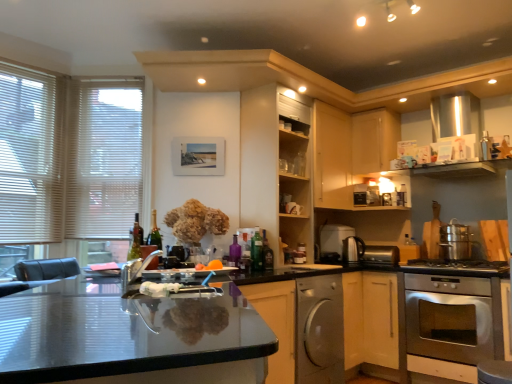
Question: Does green glass wine bottle at left lie behind shiny metallic kettle at right, which is the second appliance in front-to-back order?

Choices:
 (A) yes
 (B) no

Answer: (B)

Question: Is green glass wine bottle at left oriented towards shiny metallic kettle at right, positioned as the third appliance in left-to-right order?

Choices:
 (A) no
 (B) yes

Answer: (A)

Question: Is shiny metallic kettle at right, which is the second appliance in front-to-back order, located within green glass wine bottle at left?

Choices:
 (A) yes
 (B) no

Answer: (B)

Question: Is there a large distance between green glass wine bottle at left and shiny metallic kettle at right, positioned as the third appliance in back-to-front order?

Choices:
 (A) no
 (B) yes

Answer: (B)

Question: Does green glass wine bottle at left have a greater height compared to shiny metallic kettle at right, which is the second appliance in front-to-back order?

Choices:
 (A) yes
 (B) no

Answer: (A)

Question: Does green glass wine bottle at left have a lesser height compared to shiny metallic kettle at right, which is the second appliance in front-to-back order?

Choices:
 (A) no
 (B) yes

Answer: (A)

Question: Can you confirm if satin silver dishwasher at lower center is wider than glossy glass countertop at center?

Choices:
 (A) yes
 (B) no

Answer: (B)

Question: Is satin silver dishwasher at lower center positioned before glossy glass countertop at center?

Choices:
 (A) yes
 (B) no

Answer: (B)

Question: Is satin silver dishwasher at lower center at the left side of glossy glass countertop at center?

Choices:
 (A) no
 (B) yes

Answer: (A)

Question: Is satin silver dishwasher at lower center facing away from glossy glass countertop at center?

Choices:
 (A) yes
 (B) no

Answer: (B)

Question: Is satin silver dishwasher at lower center further to the viewer compared to glossy glass countertop at center?

Choices:
 (A) no
 (B) yes

Answer: (B)

Question: Is satin silver dishwasher at lower center completely or partially outside of glossy glass countertop at center?

Choices:
 (A) no
 (B) yes

Answer: (B)

Question: Is metallic silver toaster at lower center, which is counted as the 1th appliance, starting from the right, to the right of satin silver dishwasher at lower center from the viewer's perspective?

Choices:
 (A) no
 (B) yes

Answer: (B)